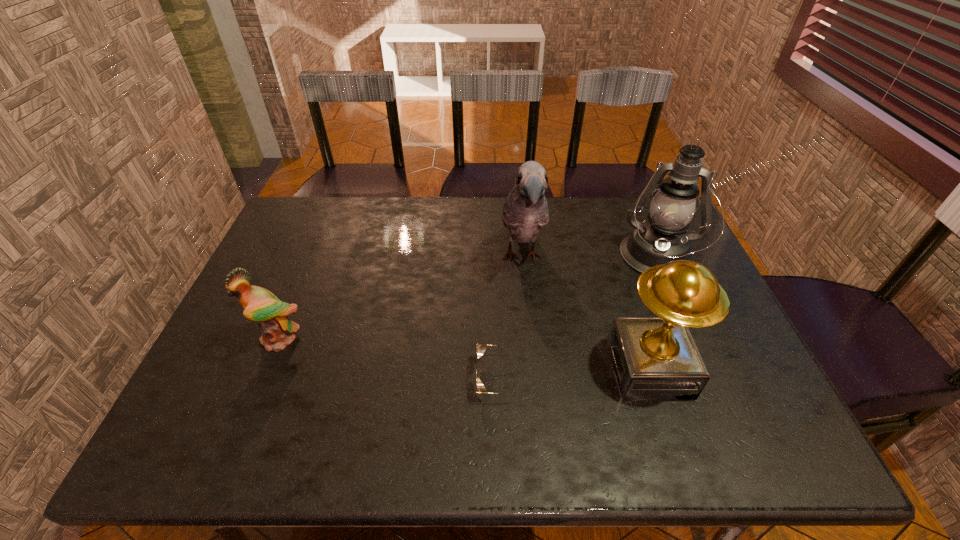
Where is `vacant point located between the left parrot and the award`? This screenshot has width=960, height=540. vacant point located between the left parrot and the award is located at coordinates (465, 354).

Where is `free spot between the right parrot and the award`? free spot between the right parrot and the award is located at coordinates (586, 313).

Locate an element on the screen. The image size is (960, 540). free space that is in between the shortest object and the nearer parrot is located at coordinates (390, 359).

Where is `blank region between the right parrot and the oil lamp`? blank region between the right parrot and the oil lamp is located at coordinates (588, 258).

Identify the location of unoccupied area between the left parrot and the shortest object. (390, 359).

The image size is (960, 540). Find the location of `unoccupied area between the left parrot and the taller parrot`. unoccupied area between the left parrot and the taller parrot is located at coordinates (400, 298).

Where is `vacant space in between the sunglasses and the farther parrot`? This screenshot has height=540, width=960. vacant space in between the sunglasses and the farther parrot is located at coordinates (512, 318).

Locate which object is the second closest to the farther parrot. Please provide its 2D coordinates. Your answer should be formatted as a tuple, i.e. [(x, y)], where the tuple contains the x and y coordinates of a point satisfying the conditions above.

[(480, 388)]

This screenshot has width=960, height=540. I want to click on object that can be found as the fourth closest to the award, so click(259, 304).

Where is `vacant region that satisfies the following two spatial constraints: 1. on the front-facing side of the farther parrot; 2. on the left side of the oil lamp`? Image resolution: width=960 pixels, height=540 pixels. vacant region that satisfies the following two spatial constraints: 1. on the front-facing side of the farther parrot; 2. on the left side of the oil lamp is located at coordinates (522, 259).